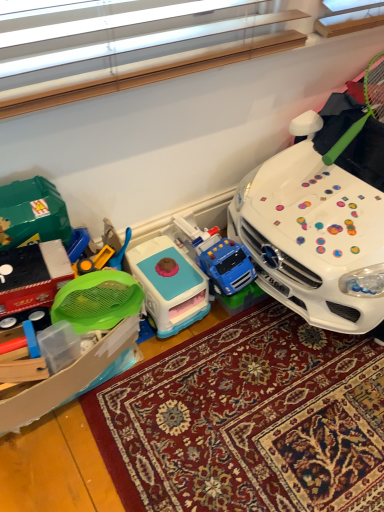
Question: In terms of size, does green mesh strainer at left, the third toy when ordered from right to left, appear bigger or smaller than white glossy car at right, marked as the 1th toy in a right-to-left arrangement?

Choices:
 (A) big
 (B) small

Answer: (B)

Question: Is green mesh strainer at left, which is the first toy from left to right, taller or shorter than white glossy car at right, marked as the 1th toy in a right-to-left arrangement?

Choices:
 (A) short
 (B) tall

Answer: (A)

Question: Estimate the real-world distances between objects in this image. Which object is closer to the white glossy car at right, marked as the 1th toy in a right-to-left arrangement?

Choices:
 (A) carpeted rug at center
 (B) green mesh strainer at left, the third toy when ordered from right to left
 (C) blue plastic play kitchen at center, arranged as the 2th toy when viewed from the left

Answer: (A)

Question: Which object is positioned closest to the carpeted rug at center?

Choices:
 (A) blue plastic play kitchen at center, which is the second toy in right-to-left order
 (B) green mesh strainer at left, which is the first toy from left to right
 (C) white glossy car at right, marked as the 1th toy in a right-to-left arrangement

Answer: (A)